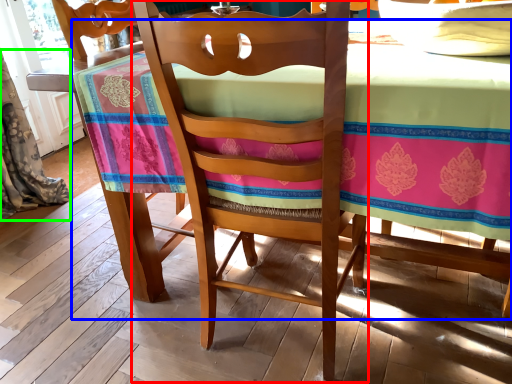
Question: Which is farther away from chair (highlighted by a red box)? table (highlighted by a blue box) or curtain (highlighted by a green box)?

Choices:
 (A) table
 (B) curtain

Answer: (B)